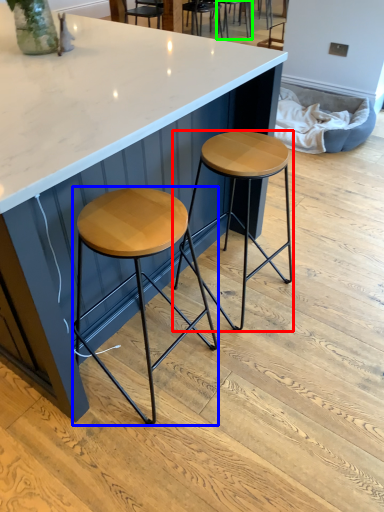
Question: Estimate the real-world distances between objects in this image. Which object is closer to stool (highlighted by a red box), stool (highlighted by a blue box) or chair (highlighted by a green box)?

Choices:
 (A) stool
 (B) chair

Answer: (A)